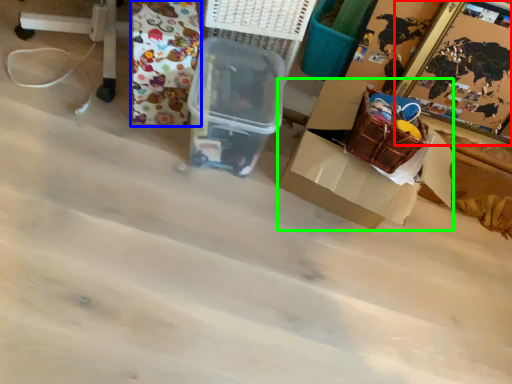
Question: Estimate the real-world distances between objects in this image. Which object is closer to picture frame (highlighted by a red box), wrapping paper (highlighted by a blue box) or box (highlighted by a green box)?

Choices:
 (A) wrapping paper
 (B) box

Answer: (B)